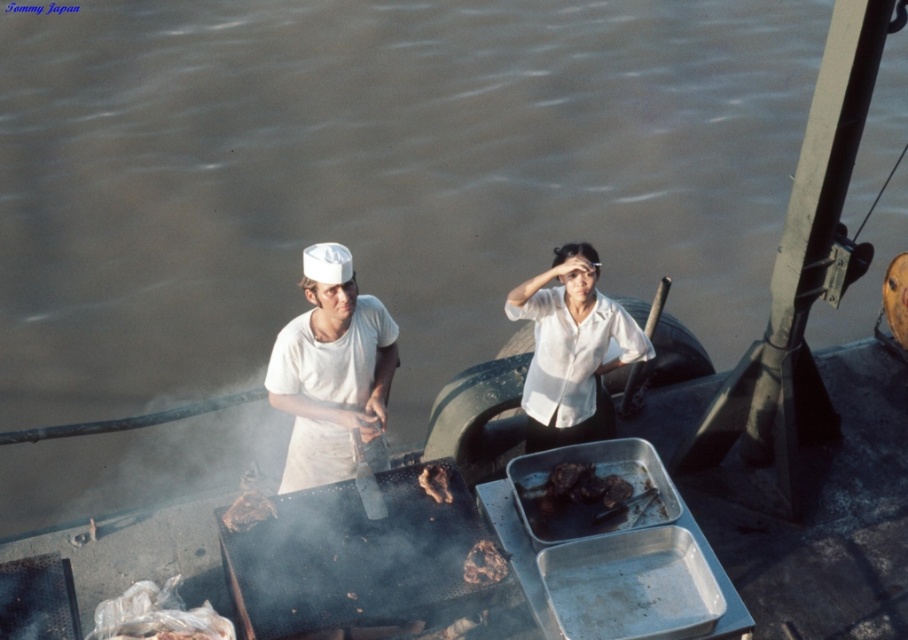
Question: Can you confirm if white matte shirt at center is positioned to the right of brown textured meat at center?

Choices:
 (A) yes
 (B) no

Answer: (B)

Question: Among these objects, which one is farthest from the camera?

Choices:
 (A) brown charred meat at center
 (B) white matte shirt at center
 (C) brown crispy meat at center

Answer: (C)

Question: Can you confirm if dark brown charred meat at center is positioned below brown textured meat at center?

Choices:
 (A) yes
 (B) no

Answer: (B)

Question: Which of the following is the closest to the observer?

Choices:
 (A) white glossy shirt at center
 (B) brown crispy meat at center
 (C) dark brown charred meat at center
 (D) brown charred meat at center

Answer: (D)

Question: In this image, where is dark brown charred meat at center located relative to brown textured meat at center?

Choices:
 (A) left
 (B) right

Answer: (B)

Question: Which point is farther from the camera taking this photo?

Choices:
 (A) (637, 349)
 (B) (623, 502)

Answer: (A)